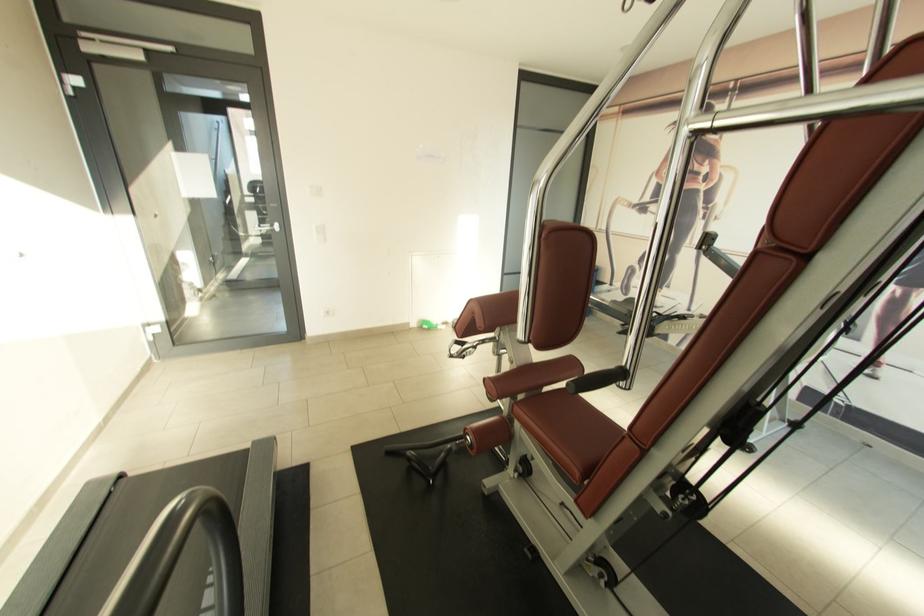
Find where to grip the black cable handle. Please return your answer as a coordinate pair (x, y).

(426, 455)